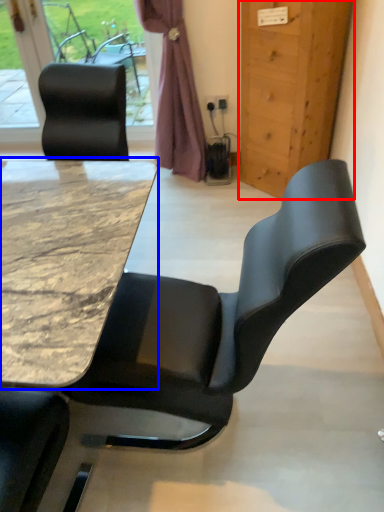
Question: Among these objects, which one is nearest to the camera, door (highlighted by a red box) or table (highlighted by a blue box)?

Choices:
 (A) door
 (B) table

Answer: (B)